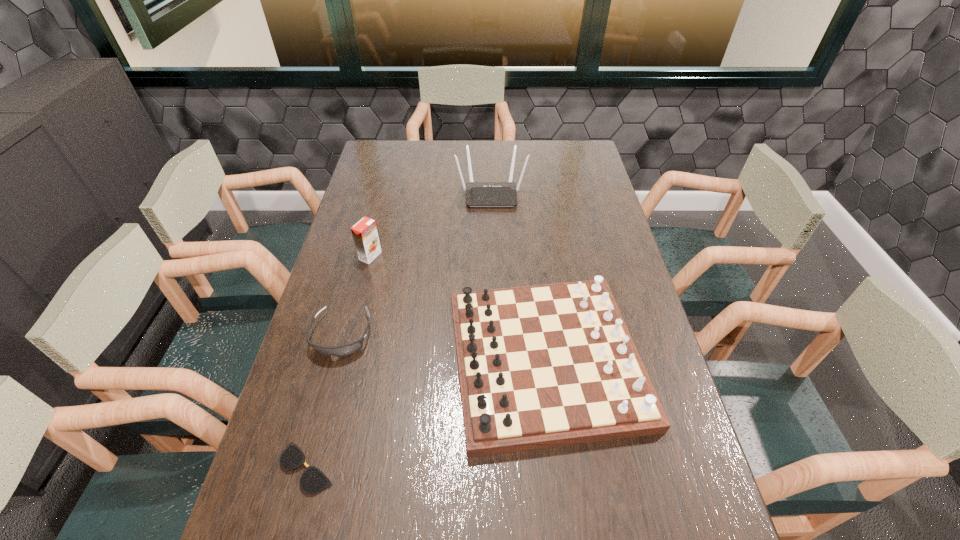
Identify the location of free space in the image that satisfies the following two spatial constraints: 1. on the lenses of the goggles; 2. on the right side of the spectacles. (306, 468).

Identify the location of vacant area in the image that satisfies the following two spatial constraints: 1. on the lenses of the chessboard; 2. on the left side of the second shortest object. This screenshot has height=540, width=960. (335, 360).